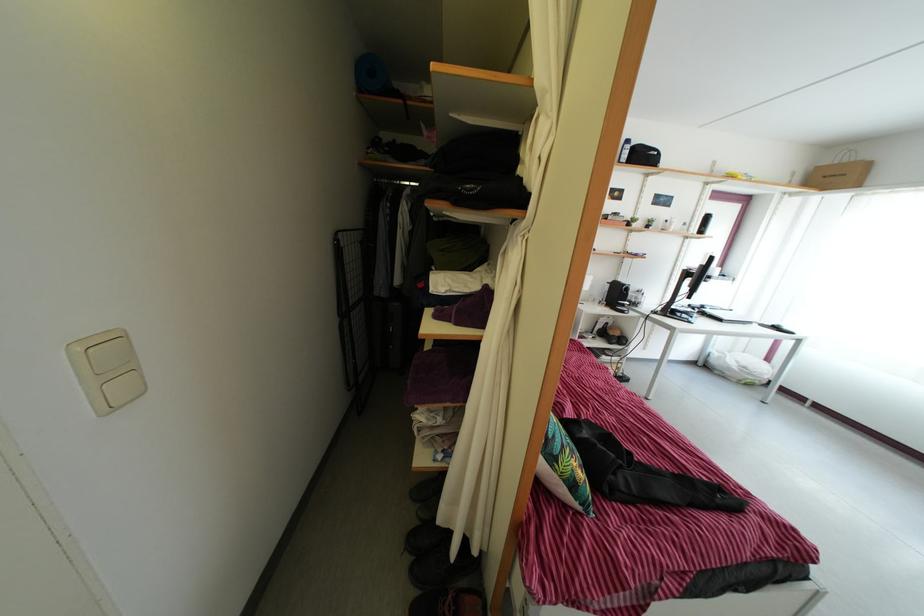
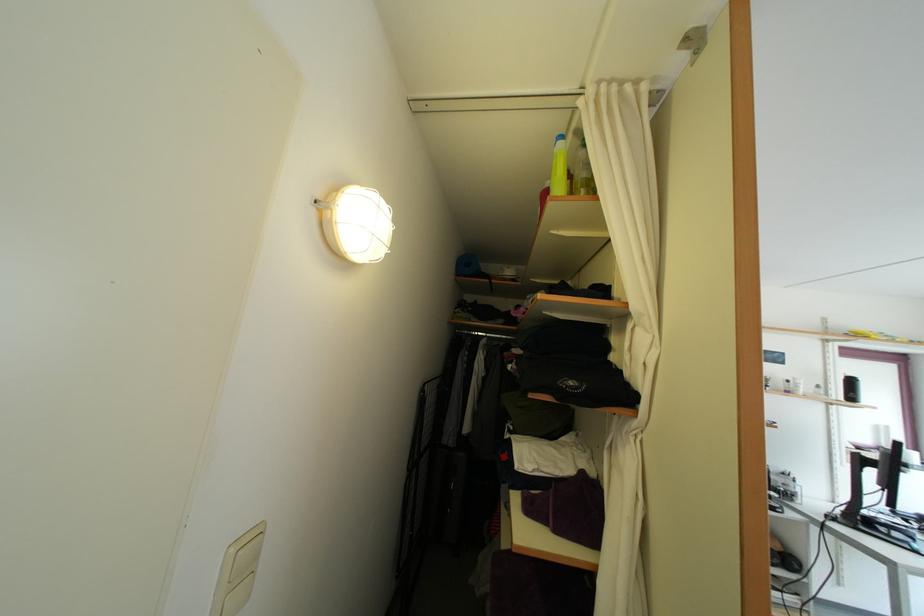
The point at (695, 289) is marked in the first image. Where is the corresponding point in the second image?

(878, 480)